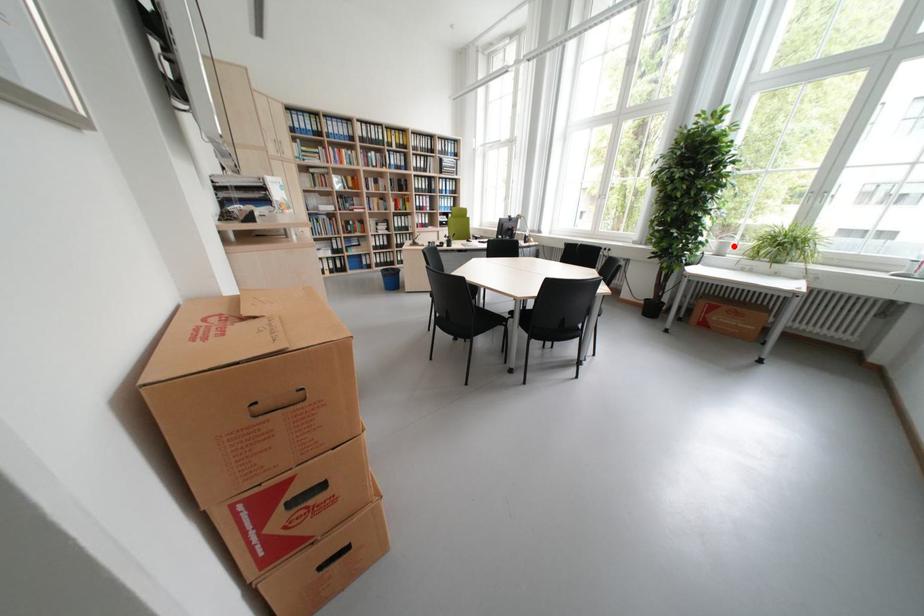
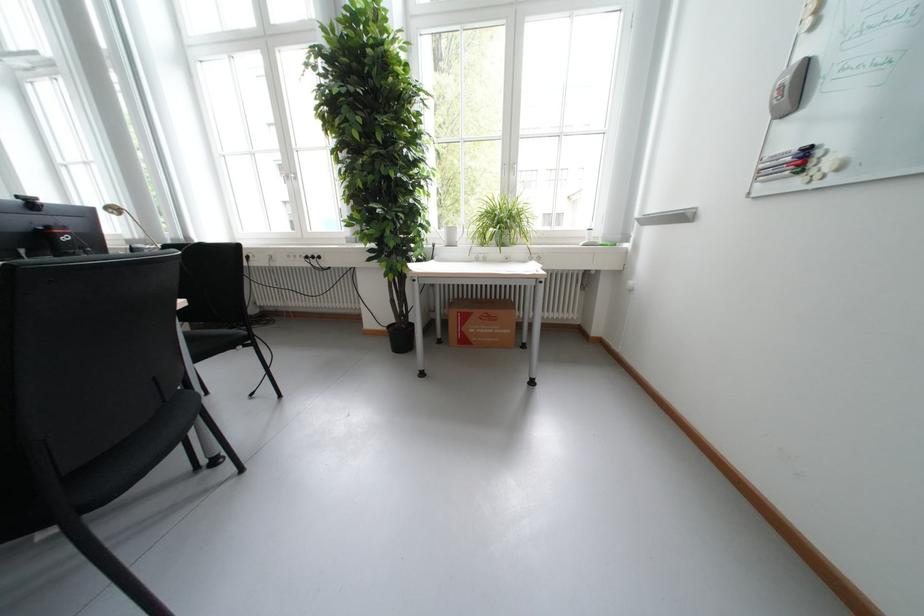
Find the pixel in the second image that matches the highlighted location in the first image.

(460, 233)